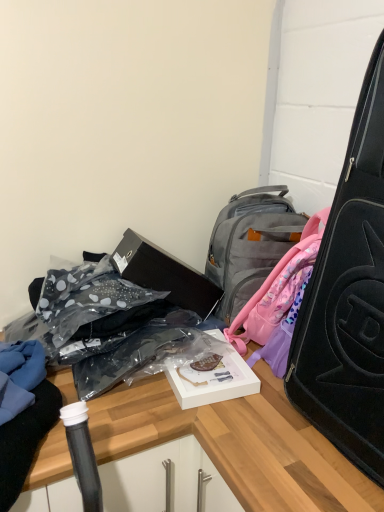
Question: Is black matte box at center wider or thinner than white matte box at center?

Choices:
 (A) wide
 (B) thin

Answer: (B)

Question: From a real-world perspective, is black matte box at center above or below white matte box at center?

Choices:
 (A) above
 (B) below

Answer: (A)

Question: Estimate the real-world distances between objects in this image. Which object is farther from the black matte suitcase at right?

Choices:
 (A) clear plastic bag at lower left
 (B) white matte box at center
 (C) black matte box at center
 (D) gray fabric backpack at upper center

Answer: (C)

Question: Which of these objects is positioned farthest from the black matte box at center?

Choices:
 (A) white matte box at center
 (B) gray fabric backpack at upper center
 (C) clear plastic bag at lower left
 (D) black matte suitcase at right

Answer: (D)